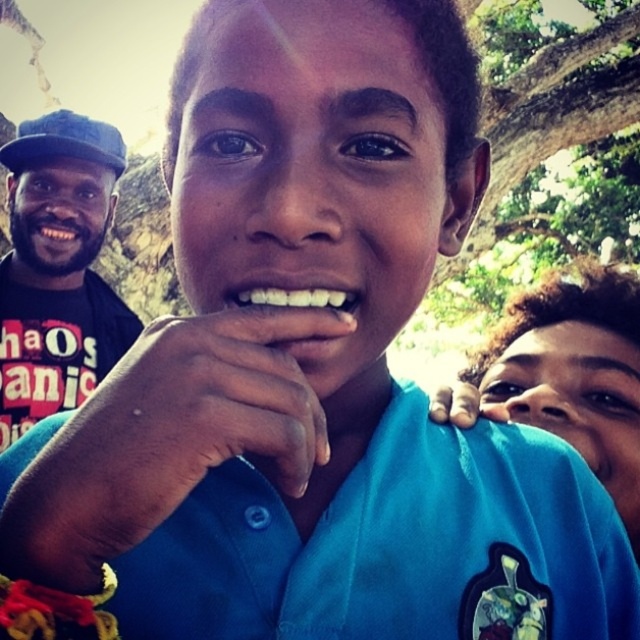
Question: Is blue fabric shirt at center to the right of white glossy teeth at center from the viewer's perspective?

Choices:
 (A) yes
 (B) no

Answer: (A)

Question: Does blue fabric shirt at center lie behind white glossy teeth at center?

Choices:
 (A) yes
 (B) no

Answer: (A)

Question: Which of the following is the closest to the observer?

Choices:
 (A) (337, 300)
 (B) (92, 308)
 (C) (616, 291)

Answer: (A)

Question: Where is black fabric shirt at left located in relation to white glossy teeth at center in the image?

Choices:
 (A) right
 (B) left

Answer: (B)

Question: Estimate the real-world distances between objects in this image. Which object is closer to the white glossy teeth at center?

Choices:
 (A) blue fabric shirt at center
 (B) black fabric shirt at left

Answer: (A)

Question: Which object appears closest to the camera in this image?

Choices:
 (A) white glossy teeth at center
 (B) black fabric shirt at left

Answer: (A)